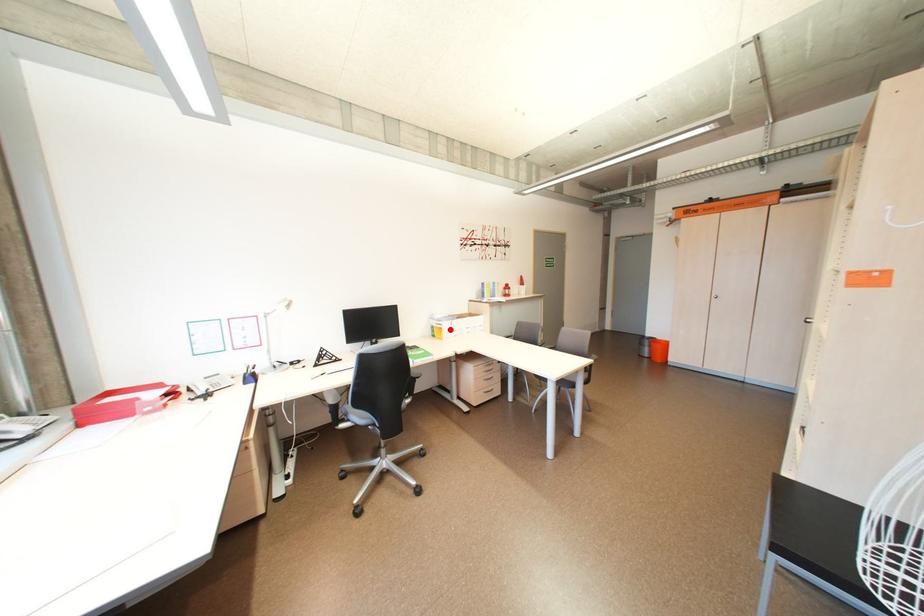
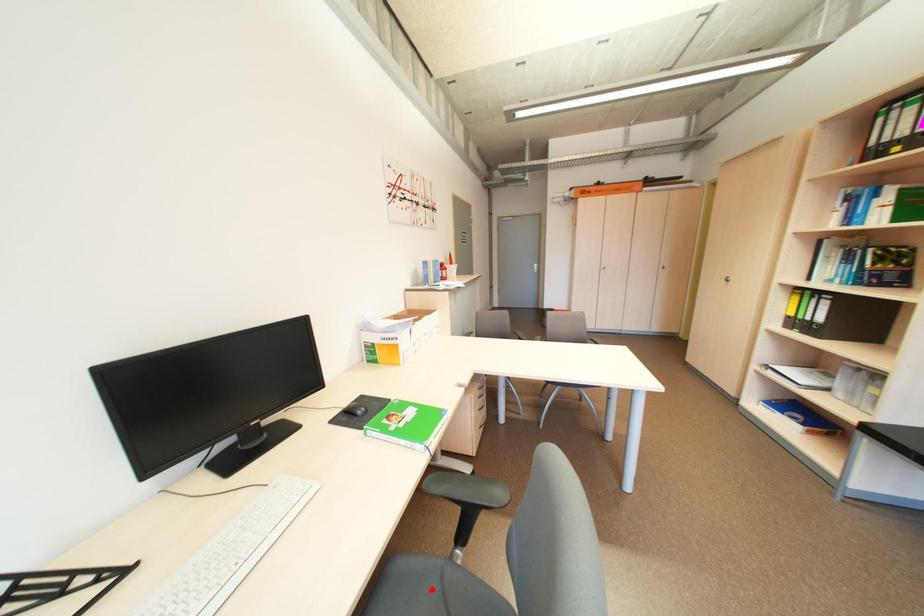
I am providing you with two images of the same scene from different viewpoints. A red point is marked on the first image and another point is marked on the second image. Are the points marked in image1 and image2 representing the same 3D position?

No